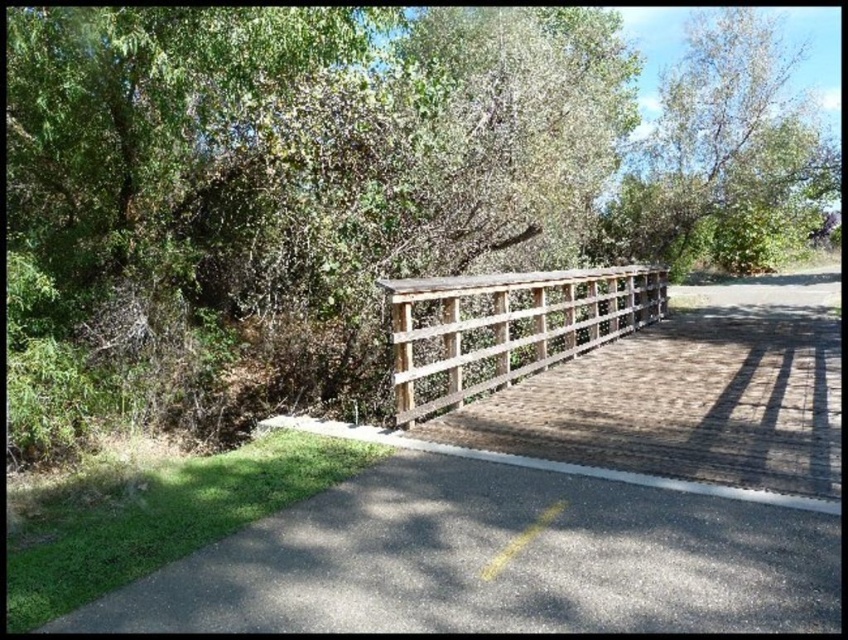
Question: Does green leafy tree at center lie in front of green leafy tree at upper right?

Choices:
 (A) no
 (B) yes

Answer: (B)

Question: Is green leafy tree at center to the left of green leafy tree at upper right from the viewer's perspective?

Choices:
 (A) no
 (B) yes

Answer: (B)

Question: Estimate the real-world distances between objects in this image. Which object is closer to the green leafy tree at upper right?

Choices:
 (A) weathered wood fence at center
 (B) green leafy tree at center

Answer: (B)

Question: Which object is positioned closest to the green leafy tree at center?

Choices:
 (A) weathered wood fence at center
 (B) green leafy tree at upper right

Answer: (A)

Question: Considering the relative positions of green leafy tree at center and weathered wood fence at center in the image provided, where is green leafy tree at center located with respect to weathered wood fence at center?

Choices:
 (A) below
 (B) above

Answer: (B)

Question: Based on their relative distances, which object is farther from the weathered wood fence at center?

Choices:
 (A) green leafy tree at upper right
 (B) green leafy tree at center

Answer: (A)